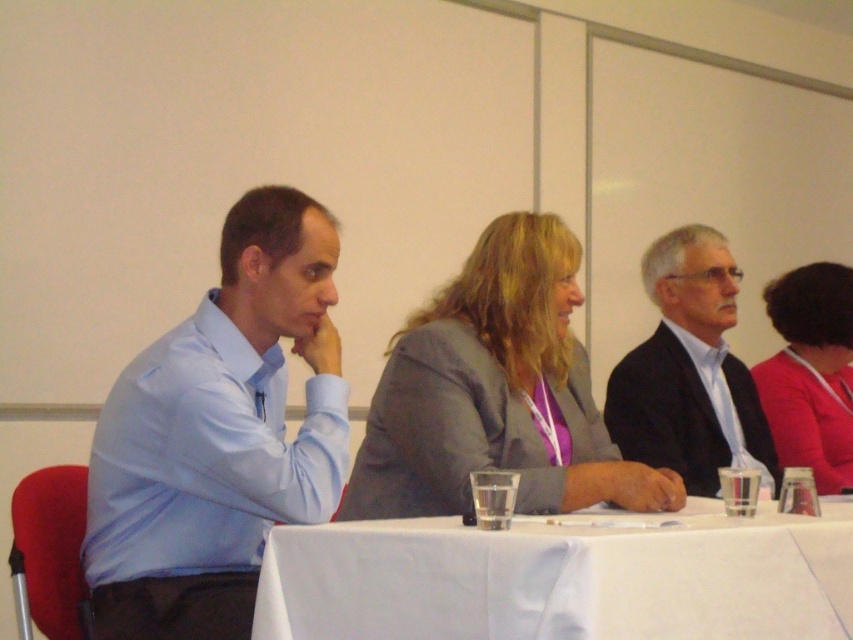
Looking at this image, what object is located at the coordinates point (564, 577) in the image?

The point (564, 577) corresponds to the white cloth at center.